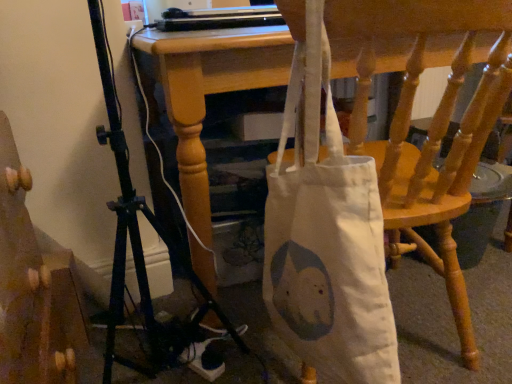
Describe the element at coordinates (33, 289) in the screenshot. I see `wooden staircase at lower left` at that location.

Locate an element on the screen. This screenshot has width=512, height=384. wooden staircase at lower left is located at coordinates (33, 289).

I want to click on white fabric bag at lower center, so (433, 118).

Image resolution: width=512 pixels, height=384 pixels. What do you see at coordinates (433, 118) in the screenshot?
I see `white fabric bag at lower center` at bounding box center [433, 118].

Identify the location of wooden staircase at lower left. This screenshot has width=512, height=384. (33, 289).

Which is more to the left, wooden staircase at lower left or white fabric bag at lower center?

Positioned to the left is wooden staircase at lower left.

Considering the relative positions of wooden staircase at lower left and white fabric bag at lower center in the image provided, is wooden staircase at lower left in front of white fabric bag at lower center?

That is True.

Does point (13, 269) appear closer or farther from the camera than point (500, 85)?

Point (13, 269) is closer to the camera than point (500, 85).

From the image's perspective, between wooden staircase at lower left and white fabric bag at lower center, which one is located above?

From the image's view, white fabric bag at lower center is above.

From a real-world perspective, is wooden staircase at lower left over white fabric bag at lower center?

Yes.

Considering the sizes of wooden staircase at lower left and white fabric bag at lower center in the image, is wooden staircase at lower left wider or thinner than white fabric bag at lower center?

In the image, wooden staircase at lower left appears to be more narrow than white fabric bag at lower center.

Does wooden staircase at lower left have a greater height compared to white fabric bag at lower center?

Indeed, wooden staircase at lower left has a greater height compared to white fabric bag at lower center.

Consider the image. Looking at the image, does wooden staircase at lower left seem bigger or smaller compared to white fabric bag at lower center?

Clearly, wooden staircase at lower left is smaller in size than white fabric bag at lower center.

Is white fabric bag at lower center completely or partially inside wooden staircase at lower left?

No, white fabric bag at lower center is not surrounded by wooden staircase at lower left.

Is wooden staircase at lower left far away from white fabric bag at lower center?

No.

Is wooden staircase at lower left oriented towards white fabric bag at lower center?

Yes, wooden staircase at lower left is oriented towards white fabric bag at lower center.

How far apart are wooden staircase at lower left and white fabric bag at lower center?

wooden staircase at lower left and white fabric bag at lower center are 28.25 inches apart.

What are the coordinates of `chair above the wooden staircase at lower left (from the image's perspective)` in the screenshot? It's located at (433, 118).

Would you say white fabric bag at lower center is to the left or to the right of wooden staircase at lower left in the picture?

From the image, it's evident that white fabric bag at lower center is to the right of wooden staircase at lower left.

Is the depth of white fabric bag at lower center greater than that of wooden staircase at lower left?

Yes, white fabric bag at lower center is further from the camera.

Is point (461, 15) closer or farther from the camera than point (7, 226)?

Point (461, 15) is closer to the camera than point (7, 226).

From the image's perspective, is white fabric bag at lower center positioned above or below wooden staircase at lower left?

white fabric bag at lower center is above wooden staircase at lower left.

From a real-world perspective, is white fabric bag at lower center positioned above or below wooden staircase at lower left?

white fabric bag at lower center is situated lower than wooden staircase at lower left in the real world.

Which of these two, white fabric bag at lower center or wooden staircase at lower left, is wider?

white fabric bag at lower center is wider.

Which of these two, white fabric bag at lower center or wooden staircase at lower left, stands shorter?

white fabric bag at lower center is shorter.

Based on the photo, can you confirm if white fabric bag at lower center is smaller than wooden staircase at lower left?

No.

Consider the image. Is wooden staircase at lower left surrounded by white fabric bag at lower center?

No, wooden staircase at lower left is not surrounded by white fabric bag at lower center.

Is the surface of white fabric bag at lower center in direct contact with wooden staircase at lower left?

No, white fabric bag at lower center is not with wooden staircase at lower left.

Looking at this image, could you tell me if white fabric bag at lower center is facing wooden staircase at lower left?

No, white fabric bag at lower center does not turn towards wooden staircase at lower left.

Locate an element on the screen. This screenshot has width=512, height=384. chair above the wooden staircase at lower left (from the image's perspective) is located at coordinates (433, 118).

Locate an element on the screen. Image resolution: width=512 pixels, height=384 pixels. chair on the right of the wooden staircase at lower left is located at coordinates (433, 118).

Find the location of `furniture in front of the white fabric bag at lower center`. furniture in front of the white fabric bag at lower center is located at coordinates (33, 289).